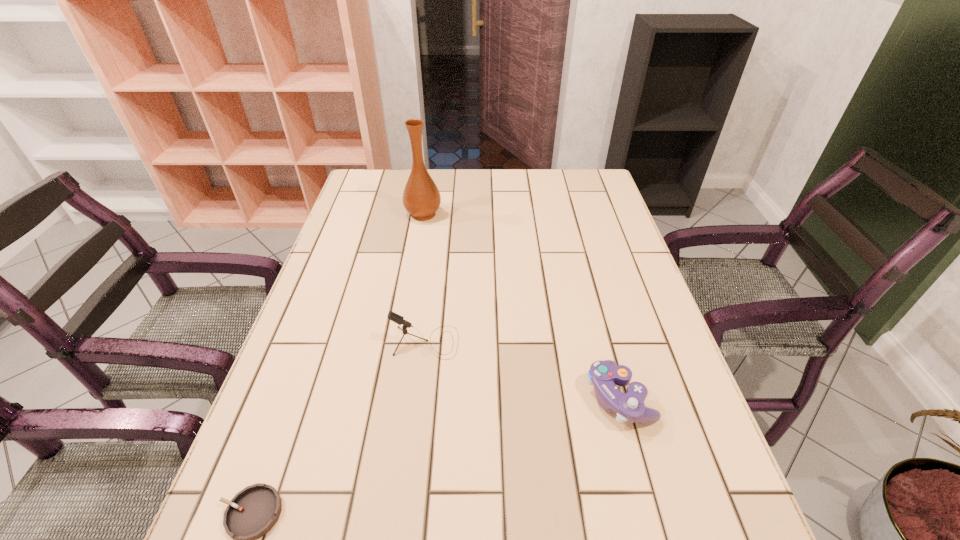
The image size is (960, 540). What are the coordinates of `empty space that is in between the third nearest object and the second shortest object` in the screenshot? It's located at (522, 370).

Where is `free space that is in between the second tallest object and the vase`? Image resolution: width=960 pixels, height=540 pixels. free space that is in between the second tallest object and the vase is located at coordinates (424, 278).

The height and width of the screenshot is (540, 960). Find the location of `free space between the third shortest object and the vase`. free space between the third shortest object and the vase is located at coordinates (424, 278).

At what (x,y) coordinates should I click in order to perform the action: click on object that is the second closest to the nearest object. Please return your answer as a coordinate pair (x, y). The image size is (960, 540). Looking at the image, I should click on (604, 375).

Find the location of a particular element. This screenshot has width=960, height=540. object that is the third closest to the nearest object is located at coordinates (421, 198).

The width and height of the screenshot is (960, 540). In order to click on vacant position in the image that satisfies the following two spatial constraints: 1. on the front side of the third tallest object; 2. on the left side of the vase in this screenshot , I will do `click(393, 397)`.